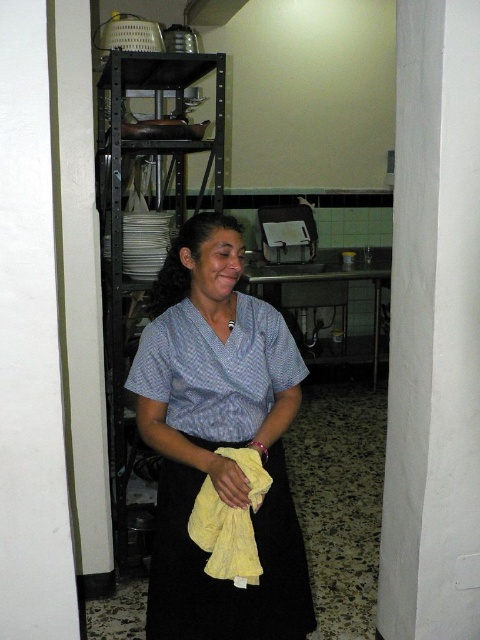
Between yellow cotton towel at center and metallic gray exhaust hood at upper center, which one appears on the right side from the viewer's perspective?

yellow cotton towel at center is more to the right.

This screenshot has height=640, width=480. What are the coordinates of `yellow cotton towel at center` in the screenshot? It's located at (217, 438).

Is point (276, 436) farther from camera compared to point (145, 387)?

Yes, point (276, 436) is farther from viewer.

Measure the distance between point (242,628) and camera.

Point (242,628) and camera are 6.25 feet apart.

Identify the location of yellow cotton towel at center. The width and height of the screenshot is (480, 640). (217, 438).

Who is shorter, yellow cotton towel at center or yellow soft cloth at center?

yellow soft cloth at center is shorter.

Can you confirm if yellow cotton towel at center is taller than yellow soft cloth at center?

Yes.

Is point (262, 400) positioned after point (190, 529)?

Yes, point (262, 400) is behind point (190, 529).

The width and height of the screenshot is (480, 640). Find the location of `yellow cotton towel at center`. yellow cotton towel at center is located at coordinates (217, 438).